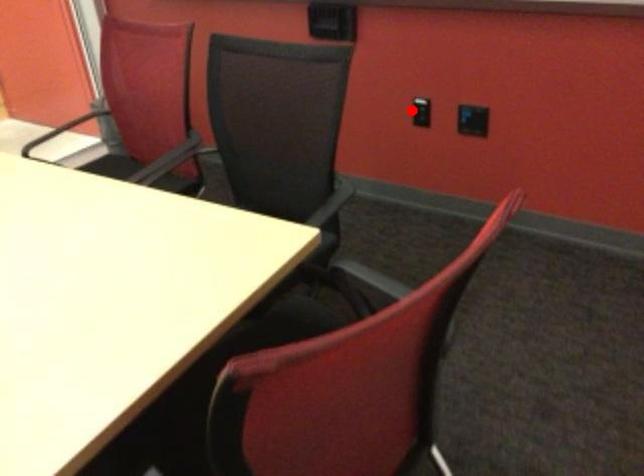
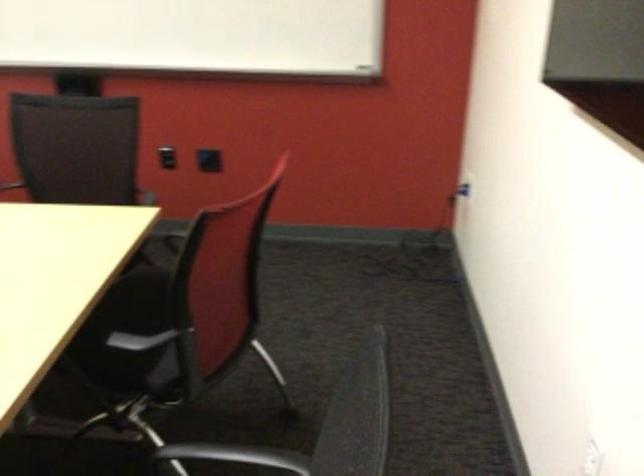
Question: I am providing you with two images of the same scene from different viewpoints. Given a red point in image1, look at the same physical point in image2. Is it:

Choices:
 (A) Closer to the viewpoint
 (B) Farther from the viewpoint

Answer: (B)